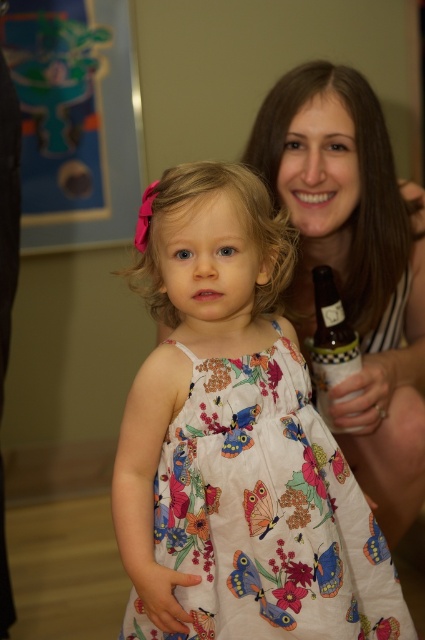
You are a tailor who needs to determine which dress requires more fabric to make between the floral cotton dress at center and the matte white dress at center. Based on their sizes, which one would need more fabric?

The matte white dress at center requires more fabric because it is larger than the floral cotton dress at center.

You are a photographer setting up for a photoshoot and need to position the matte white dress at center and the translucent glass bottle at right in a way that they are both visible in the frame. Based on their current positions, which object is closer to the left edge of the frame?

The translucent glass bottle at right is closer to the left edge of the frame because the matte white dress at center is positioned on the right side of it.

Based on the photo, you are a tailor measuring two dresses for alterations. The floral cotton dress at center and the matte white dress at center need to be adjusted to the same length. Which dress requires more fabric to be added if the floral cotton dress is shorter than the matte white dress?

The floral cotton dress at center requires more fabric to be added because it is shorter than the matte white dress at center, and the distance between them is 18.64 inches. However, the exact amount of fabric needed depends on the desired final length.